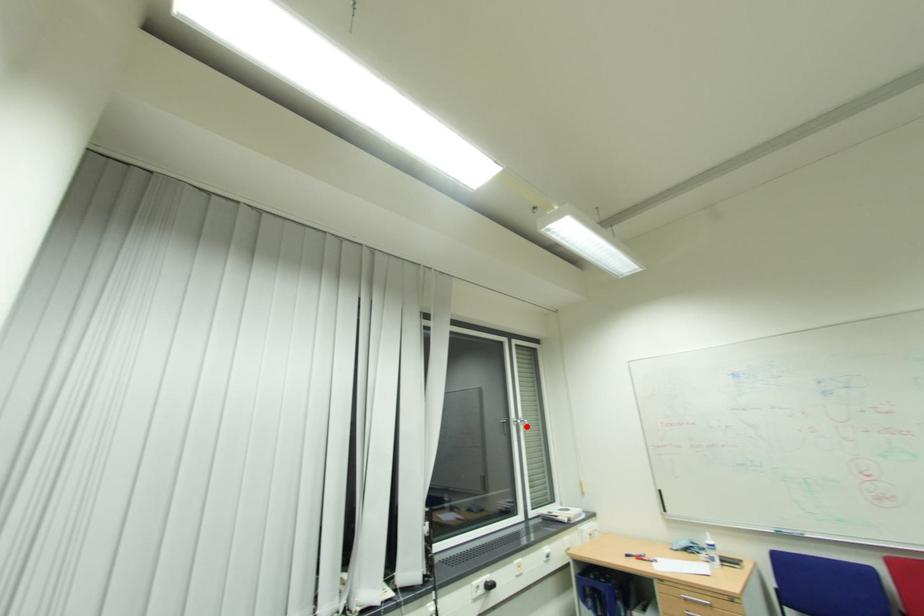
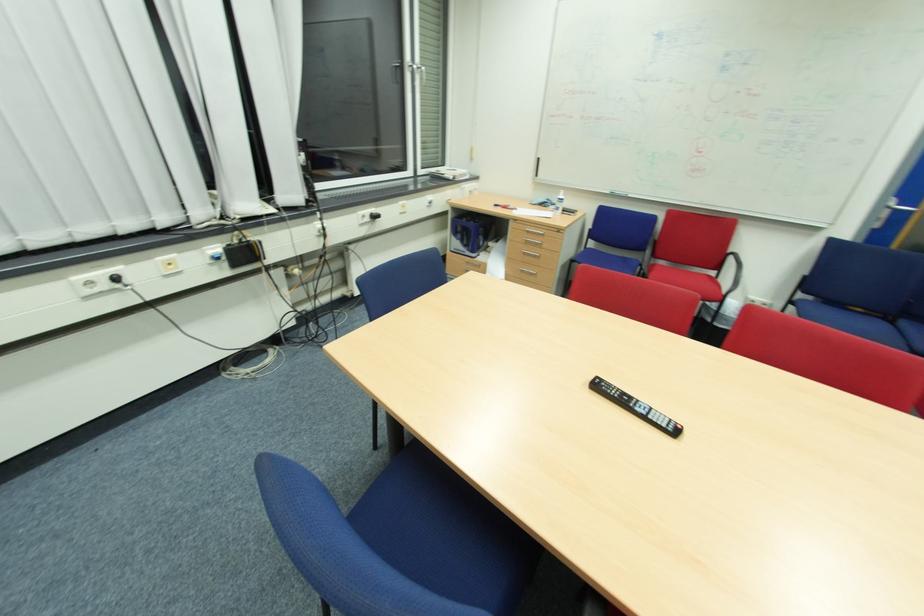
Question: I am providing you with two images of the same scene from different viewpoints. Image1 has a red point marked. In image2, the corresponding 3D location appears at what relative position? Reply with the corresponding letter.

Choices:
 (A) Closer
 (B) Farther

Answer: (A)